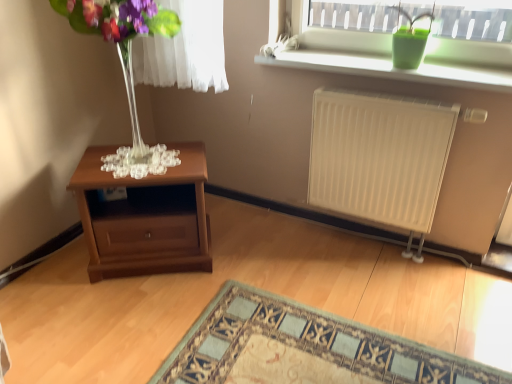
Locate an element on the screen. Image resolution: width=512 pixels, height=384 pixels. vacant area situated below carpet with intricate pattern at lower center (from a real-world perspective) is located at coordinates click(x=310, y=352).